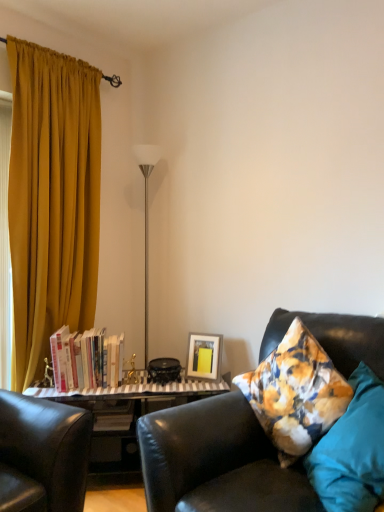
Question: Could hardcover books at left be considered to be inside teal fabric pillow at right?

Choices:
 (A) no
 (B) yes

Answer: (A)

Question: From a real-world perspective, is teal fabric pillow at right over hardcover books at left?

Choices:
 (A) yes
 (B) no

Answer: (B)

Question: Is teal fabric pillow at right to the right of hardcover books at left from the viewer's perspective?

Choices:
 (A) yes
 (B) no

Answer: (A)

Question: From the image's perspective, is teal fabric pillow at right under hardcover books at left?

Choices:
 (A) yes
 (B) no

Answer: (A)

Question: Could you tell me if teal fabric pillow at right is turned towards hardcover books at left?

Choices:
 (A) yes
 (B) no

Answer: (B)

Question: Considering the relative sizes of teal fabric pillow at right and hardcover books at left in the image provided, is teal fabric pillow at right taller than hardcover books at left?

Choices:
 (A) no
 (B) yes

Answer: (B)

Question: Is silver/metallic floor lamp at center behind leather couch at right?

Choices:
 (A) no
 (B) yes

Answer: (B)

Question: Does silver/metallic floor lamp at center have a lesser width compared to leather couch at right?

Choices:
 (A) yes
 (B) no

Answer: (A)

Question: Is silver/metallic floor lamp at center facing towards leather couch at right?

Choices:
 (A) no
 (B) yes

Answer: (A)

Question: Can you confirm if silver/metallic floor lamp at center is taller than leather couch at right?

Choices:
 (A) no
 (B) yes

Answer: (B)

Question: Considering the relative positions of silver/metallic floor lamp at center and leather couch at right in the image provided, is silver/metallic floor lamp at center in front of leather couch at right?

Choices:
 (A) no
 (B) yes

Answer: (A)

Question: From a real-world perspective, is silver/metallic floor lamp at center beneath leather couch at right?

Choices:
 (A) yes
 (B) no

Answer: (B)

Question: Is leather couch at right positioned in front of teal fabric pillow at right?

Choices:
 (A) no
 (B) yes

Answer: (B)